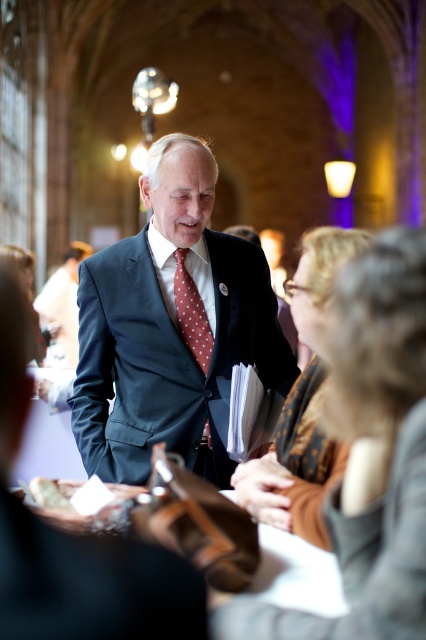
A person is standing at point A with coordinates point A at (141,300). They need to walk to point B, which is 80.56 feet away. If the person walks at a speed of 3 feet per second, how many seconds will it take them to reach point B?

The distance between point A at (141,300) and point B is 80.56 feet. At a walking speed of 3 feet per second, the time required is 80.56 divided by 3, which equals approximately 26.85 seconds. So, it will take about 26.85 seconds to reach point B.

You are organizing a photo shoot in this grand hall and need to ensure that the matte blue suit at center and the brown textured scarf at center are visible in the frame. Given their sizes, which object might require more careful framing to ensure it doesn not get lost in the background?

The matte blue suit at center is smaller than the brown textured scarf at center, so the smaller matte blue suit at center might require more careful framing to ensure it doesn not get lost in the background.